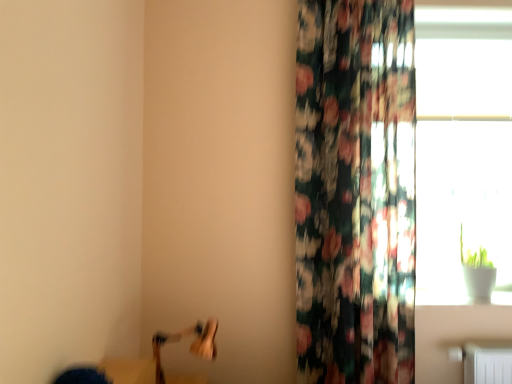
Question: From the image's perspective, does transparent glass window at upper right appear higher than wooden swivel chair at lower left?

Choices:
 (A) yes
 (B) no

Answer: (A)

Question: Does transparent glass window at upper right have a larger size compared to wooden swivel chair at lower left?

Choices:
 (A) no
 (B) yes

Answer: (B)

Question: Can you confirm if transparent glass window at upper right is positioned to the left of wooden swivel chair at lower left?

Choices:
 (A) yes
 (B) no

Answer: (B)

Question: Is transparent glass window at upper right next to wooden swivel chair at lower left and touching it?

Choices:
 (A) yes
 (B) no

Answer: (B)

Question: From a real-world perspective, is transparent glass window at upper right physically below wooden swivel chair at lower left?

Choices:
 (A) no
 (B) yes

Answer: (A)

Question: Does transparent glass window at upper right have a greater width compared to wooden swivel chair at lower left?

Choices:
 (A) yes
 (B) no

Answer: (B)

Question: Considering the relative positions of floral fabric curtain at right and transparent glass window at upper right in the image provided, is floral fabric curtain at right to the right of transparent glass window at upper right from the viewer's perspective?

Choices:
 (A) yes
 (B) no

Answer: (B)

Question: Is floral fabric curtain at right surrounding transparent glass window at upper right?

Choices:
 (A) no
 (B) yes

Answer: (A)

Question: Is floral fabric curtain at right positioned in front of transparent glass window at upper right?

Choices:
 (A) no
 (B) yes

Answer: (B)

Question: Considering the relative sizes of floral fabric curtain at right and transparent glass window at upper right in the image provided, is floral fabric curtain at right bigger than transparent glass window at upper right?

Choices:
 (A) no
 (B) yes

Answer: (B)

Question: From the image's perspective, is floral fabric curtain at right on top of transparent glass window at upper right?

Choices:
 (A) no
 (B) yes

Answer: (A)

Question: Is floral fabric curtain at right wider than transparent glass window at upper right?

Choices:
 (A) yes
 (B) no

Answer: (A)

Question: Is wooden swivel chair at lower left at the left side of transparent glass window at upper right?

Choices:
 (A) yes
 (B) no

Answer: (A)